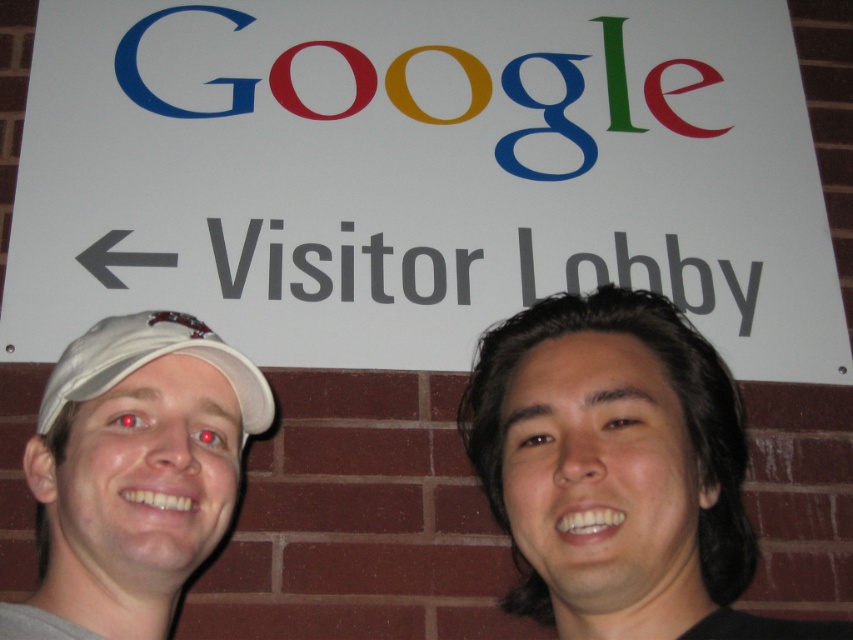
Question: Is white paper sign at upper center positioned in front of white fabric baseball cap at left?

Choices:
 (A) yes
 (B) no

Answer: (B)

Question: Considering the relative positions of white paper sign at upper center and white matte cap at left in the image provided, where is white paper sign at upper center located with respect to white matte cap at left?

Choices:
 (A) right
 (B) left

Answer: (A)

Question: Which object is positioned farthest from the white fabric baseball cap at left?

Choices:
 (A) white matte cap at left
 (B) white paper sign at upper center

Answer: (B)

Question: Which of the following is the closest to the observer?

Choices:
 (A) white paper sign at upper center
 (B) white fabric baseball cap at left
 (C) black hair at right
 (D) white matte cap at left

Answer: (C)

Question: Considering the real-world distances, which object is farthest from the white matte cap at left?

Choices:
 (A) white paper sign at upper center
 (B) white fabric baseball cap at left

Answer: (A)

Question: Is black hair at right above white fabric baseball cap at left?

Choices:
 (A) no
 (B) yes

Answer: (A)